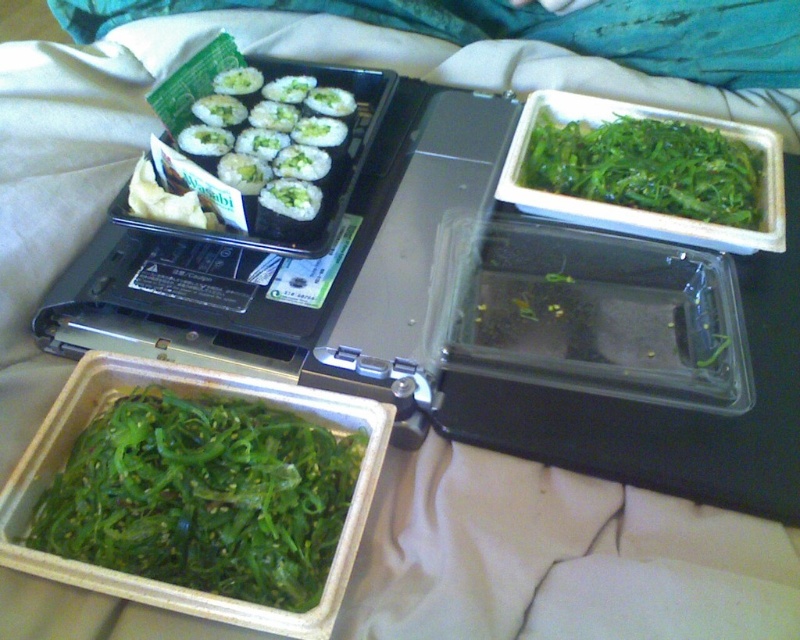
Does point (318, 500) come closer to viewer compared to point (277, 138)?

Yes, point (318, 500) is in front of point (277, 138).

Which is behind, point (206, 444) or point (280, 86)?

Positioned behind is point (280, 86).

The height and width of the screenshot is (640, 800). What are the coordinates of `green leafy seaweed at lower left` in the screenshot? It's located at (204, 497).

Between point (134, 547) and point (628, 150), which one is positioned behind?

The point (628, 150) is more distant.

Consider the image. Is green leafy seaweed at lower left wider than green leafy vegetable at upper right?

No.

Does point (112, 540) come in front of point (722, 141)?

Yes.

Identify the location of green leafy seaweed at lower left. (204, 497).

Which is above, green leafy vegetable at upper right or white rice with green topping at upper left?

white rice with green topping at upper left

Is green leafy vegetable at upper right below white rice with green topping at upper left?

Indeed, green leafy vegetable at upper right is positioned under white rice with green topping at upper left.

Which is in front, point (613, 182) or point (278, 164)?

Point (278, 164)

You are a GUI agent. You are given a task and a screenshot of the screen. Output one action in this format:
    pyautogui.click(x=<x>, y=<y>)
    Task: Click on the green leafy vegetable at upper right
    The height and width of the screenshot is (640, 800).
    Given the screenshot: What is the action you would take?
    pyautogui.click(x=645, y=168)